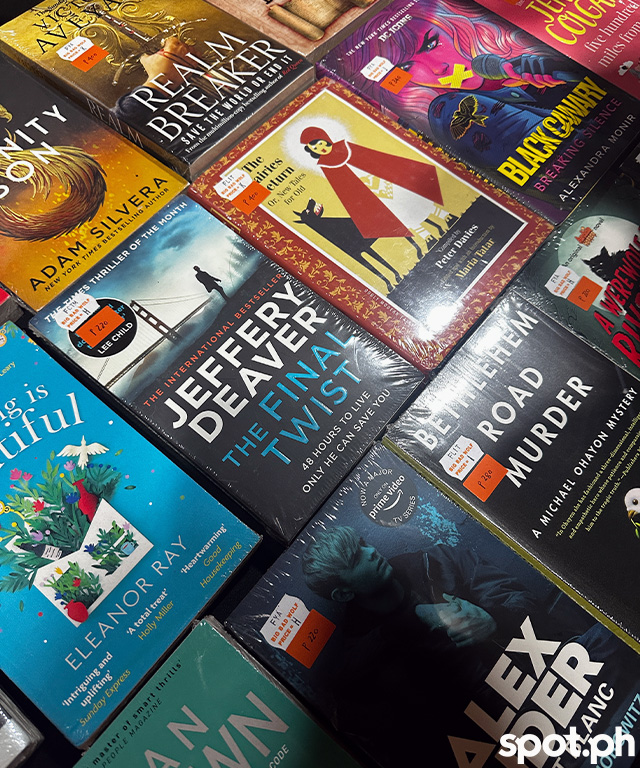
Locate an element on the screen. The width and height of the screenshot is (640, 768). book is located at coordinates (573, 558).